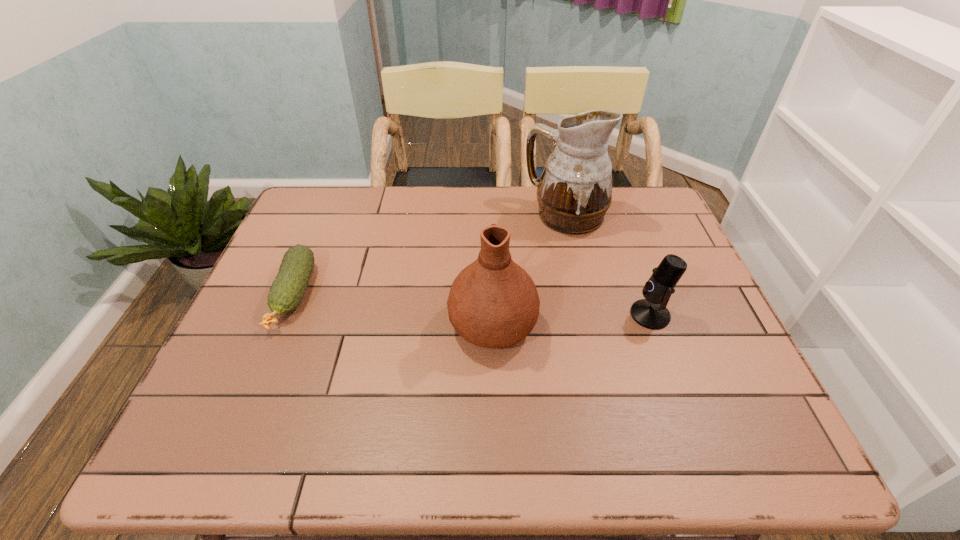
Find the location of a particular element. This screenshot has height=540, width=960. vacant space at the far edge is located at coordinates (531, 195).

The image size is (960, 540). Identify the location of free space at the near edge of the desktop. (346, 454).

At what (x,y) coordinates should I click in order to perform the action: click on vacant space at the left edge of the desktop. Please return your answer as a coordinate pair (x, y). Looking at the image, I should click on (199, 404).

In the image, there is a desktop. At what (x,y) coordinates should I click in order to perform the action: click on vacant space at the far left corner. Please return your answer as a coordinate pair (x, y). This screenshot has height=540, width=960. Looking at the image, I should click on (322, 199).

I want to click on free space at the near left corner, so click(x=250, y=423).

Where is `free space at the near right corner of the desktop`? Image resolution: width=960 pixels, height=540 pixels. free space at the near right corner of the desktop is located at coordinates (770, 441).

The image size is (960, 540). What are the coordinates of `vacant area that lies between the farthest object and the cucumber` in the screenshot? It's located at (429, 255).

This screenshot has height=540, width=960. Identify the location of free area in between the taller pitcher and the shorter pitcher. (529, 269).

The height and width of the screenshot is (540, 960). What are the coordinates of `free area in between the farthest object and the microphone` in the screenshot? It's located at click(x=608, y=265).

Find the location of a particular element. The image size is (960, 540). vacant region between the right pitcher and the microphone is located at coordinates (608, 265).